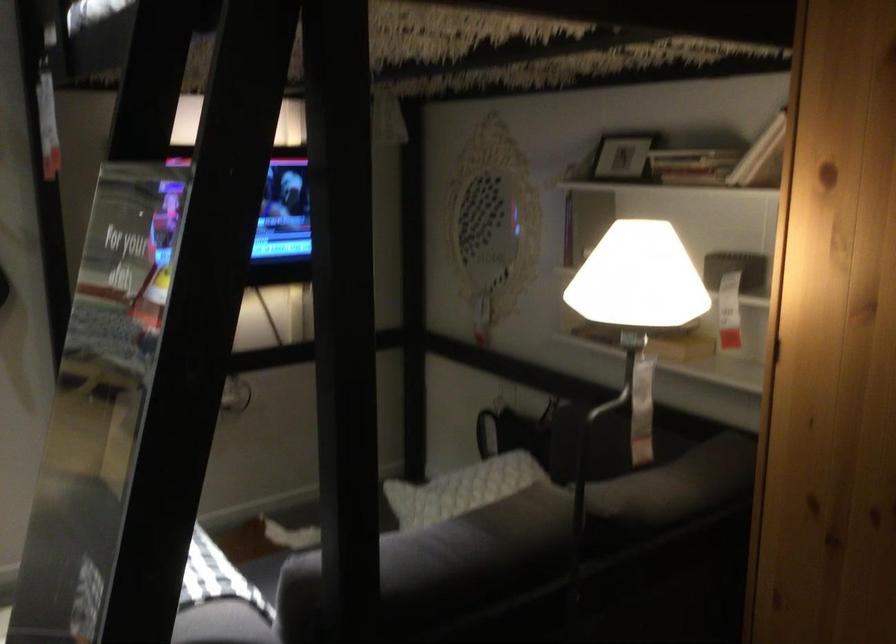
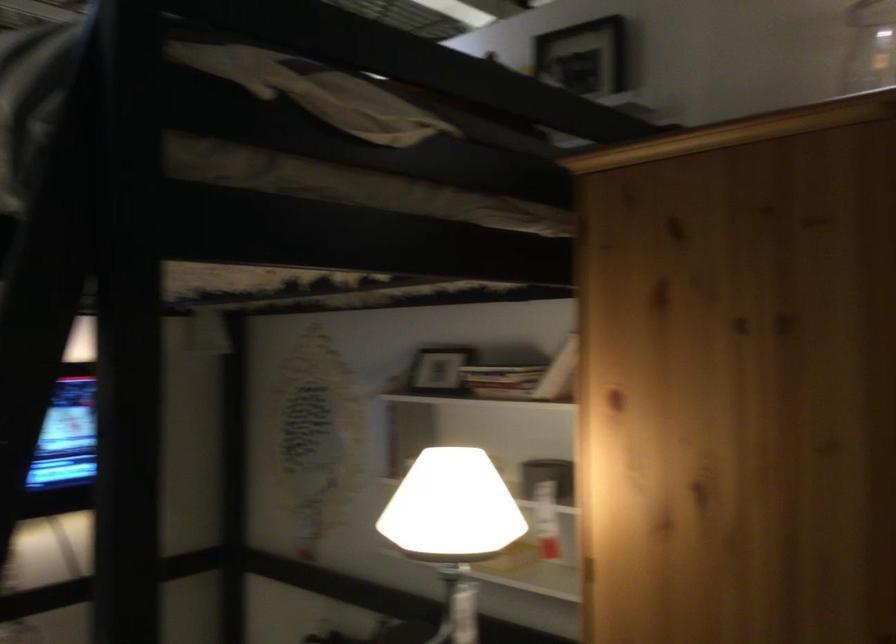
Find the pixel in the second image that matches (688,162) in the first image.

(501, 379)